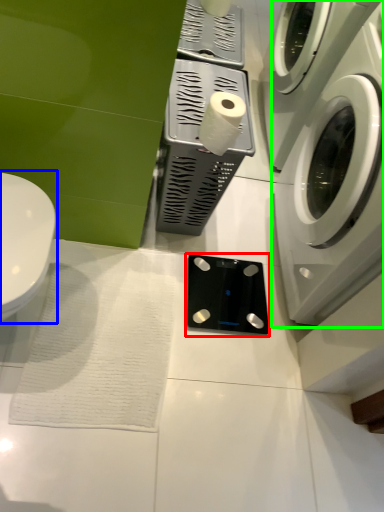
Question: Considering the real-world distances, which object is farthest from appliance (highlighted by a red box)? toilet (highlighted by a blue box) or washing machine (highlighted by a green box)?

Choices:
 (A) toilet
 (B) washing machine

Answer: (A)